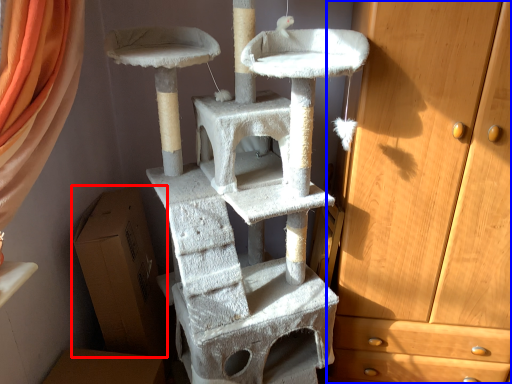
Question: Which object appears farthest to the camera in this image, cardboard box (highlighted by a red box) or chest of drawers (highlighted by a blue box)?

Choices:
 (A) cardboard box
 (B) chest of drawers

Answer: (A)